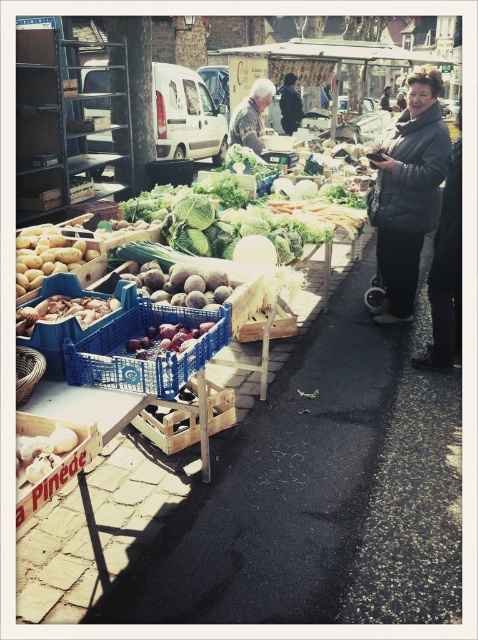
Question: Among these objects, which one is nearest to the camera?

Choices:
 (A) leather jacket at center
 (B) dark gray puffer jacket at right
 (C) dark gray jacket at center

Answer: (B)

Question: Is dark gray textured coat at right to the right of dark gray jacket at center from the viewer's perspective?

Choices:
 (A) no
 (B) yes

Answer: (B)

Question: Does blue plastic crate at center have a smaller size compared to dark gray jacket at center?

Choices:
 (A) no
 (B) yes

Answer: (B)

Question: Does dark gray puffer jacket at right come in front of blue plastic crate at center?

Choices:
 (A) no
 (B) yes

Answer: (A)

Question: Which object is positioned farthest from the dark gray textured coat at right?

Choices:
 (A) leather jacket at center
 (B) blue plastic crate at center

Answer: (A)

Question: Which object is positioned closest to the dark gray puffer jacket at right?

Choices:
 (A) dark gray textured coat at right
 (B) leather jacket at center
 (C) blue plastic crate at center
 (D) dark gray jacket at center

Answer: (A)